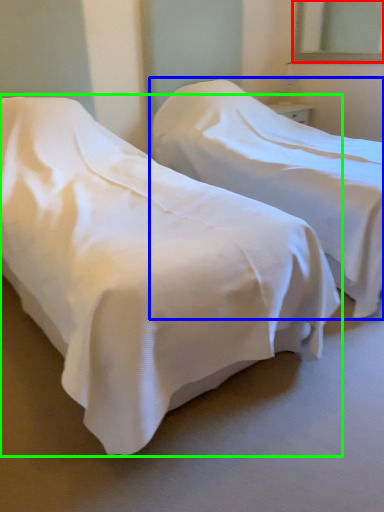
Question: Which object is the farthest from mirror (highlighted by a red box)? Choose among these: bed (highlighted by a blue box) or bed (highlighted by a green box).

Choices:
 (A) bed
 (B) bed

Answer: (B)